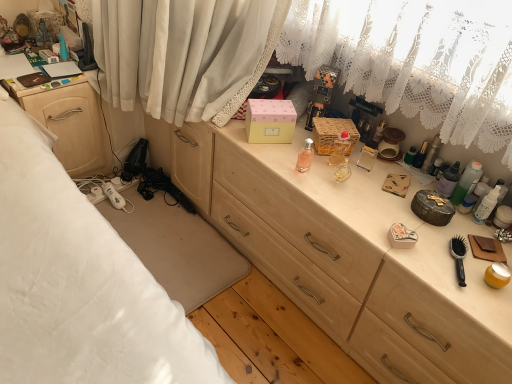
You are a GUI agent. You are given a task and a screenshot of the screen. Output one action in this format:
    pyautogui.click(x=<x>, y=<y>)
    Task: Click on the vacant location behind translucent glass perfume at center, acting as the second toiletry starting from the left
    
    Given the screenshot: What is the action you would take?
    pyautogui.click(x=334, y=145)